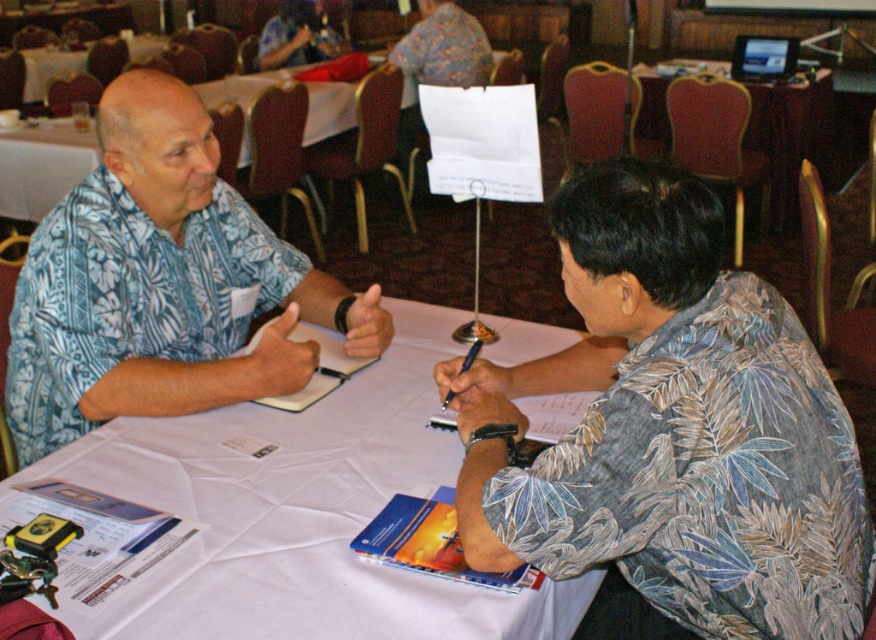
You are a person who wants to hand a document to the blue floral shirt at left. You are currently standing 3 feet away from them. Can you reach them without moving?

The blue floral shirt at left is 5.38 feet away from you. Since you are only 3 feet away, you can extend your arm and hand the document to them without needing to move closer.

You are organizing a costume party and need to ensure all outfits fit through a narrow doorway. The printed fabric shirt at center and the blue floral shirt at left are part of the costumes. Which shirt is narrower and thus more likely to fit through the doorway without adjustments?

The printed fabric shirt at center has a lesser width compared to the blue floral shirt at left, so it is narrower and more likely to fit through the doorway without adjustments.

You are organizing a clothing drive and need to determine which shirt can fit into a donation box that has a width capacity of 40 cm. Given the blue floral shirt at left and the matte blue shirt at upper left, which one is wider and thus might not fit?

The blue floral shirt at left is wider than the matte blue shirt at upper left, so it might not fit into the donation box with a 40 cm width capacity if its width exceeds the limit.